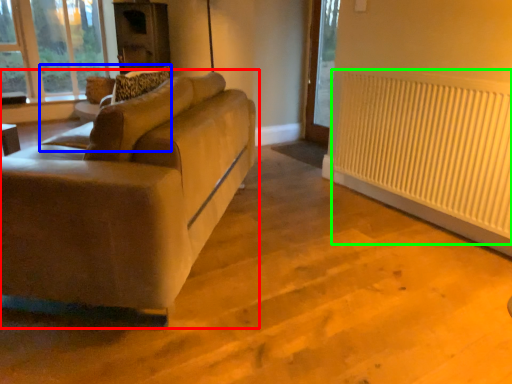
Question: Based on their relative distances, which object is farther from studio couch (highlighted by a red box)? Choose from swivel chair (highlighted by a blue box) and radiator (highlighted by a green box).

Choices:
 (A) swivel chair
 (B) radiator

Answer: (B)